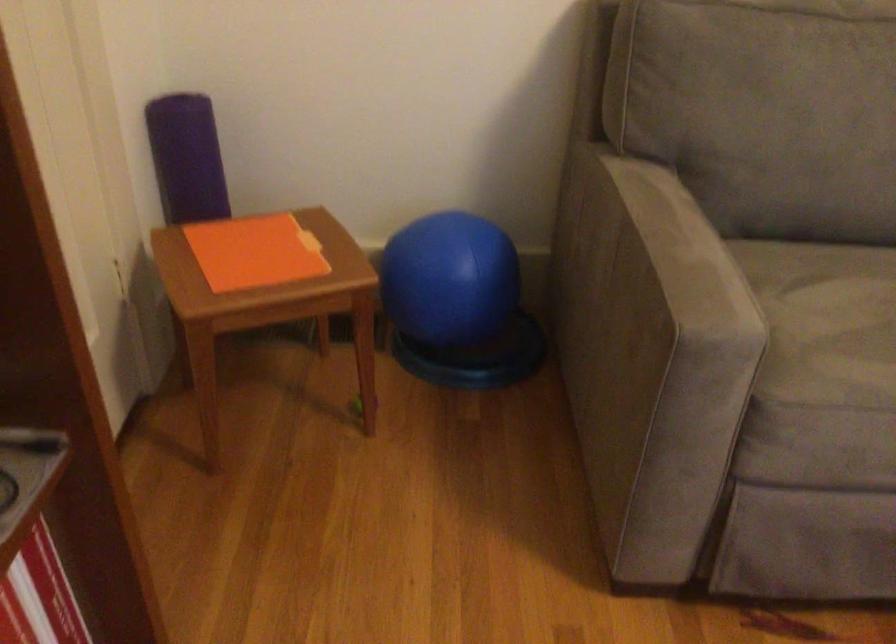
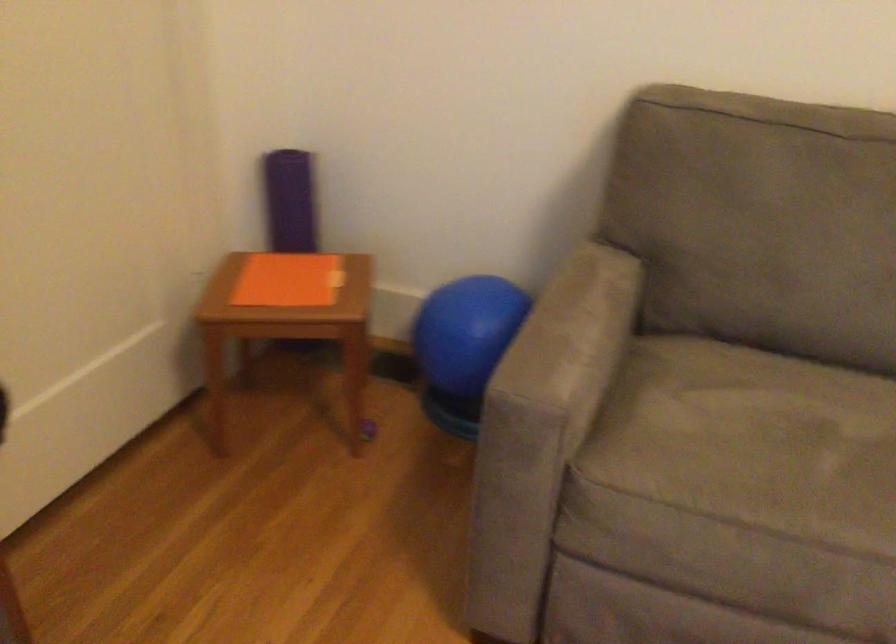
Where in the second image is the point corresponding to point 262,252 from the first image?

(288, 279)